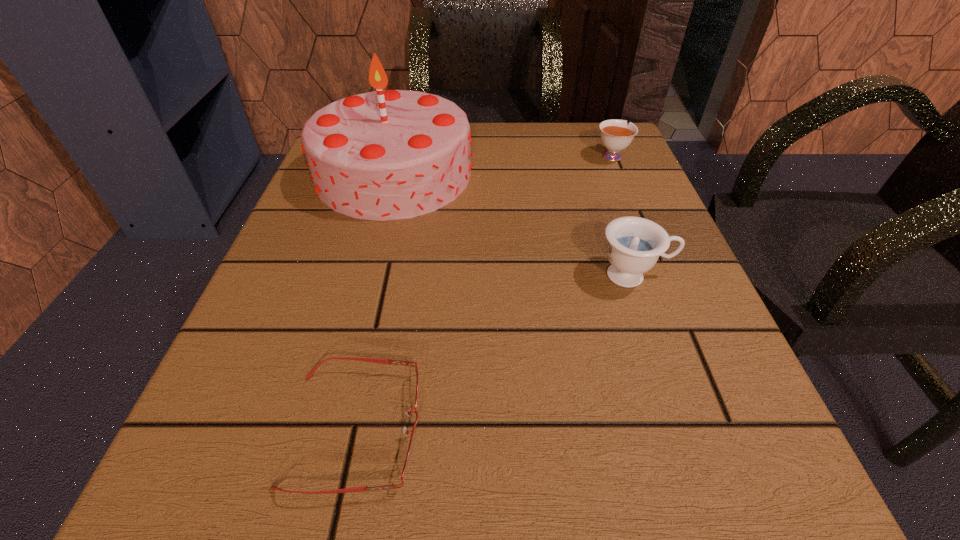
Identify the location of free space at the right edge of the desktop. (686, 262).

Locate an element on the screen. This screenshot has height=540, width=960. vacant space at the far right corner of the desktop is located at coordinates (629, 165).

Where is `vacant area at the near right corner`? Image resolution: width=960 pixels, height=540 pixels. vacant area at the near right corner is located at coordinates (780, 524).

Identify the location of free point between the farther teacup and the birthday cake. (503, 165).

You are a GUI agent. You are given a task and a screenshot of the screen. Output one action in this format:
    pyautogui.click(x=<x>, y=<y>)
    Task: Click on the empty space between the shortest object and the birthday cake
    This screenshot has height=540, width=960.
    Given the screenshot: What is the action you would take?
    pyautogui.click(x=374, y=301)

The height and width of the screenshot is (540, 960). I want to click on unoccupied position between the tallest object and the third farthest object, so click(x=514, y=225).

Identify the location of empty space that is in between the third shortest object and the shorter teacup. The height and width of the screenshot is (540, 960). (623, 215).

The height and width of the screenshot is (540, 960). What are the coordinates of `vacant point located between the shorter teacup and the tallest object` in the screenshot? It's located at (503, 165).

Locate an element on the screen. This screenshot has height=540, width=960. vacant region between the tallest object and the nearest object is located at coordinates (374, 301).

What are the coordinates of `free area in between the nearest object and the birthday cake` in the screenshot? It's located at (374, 301).